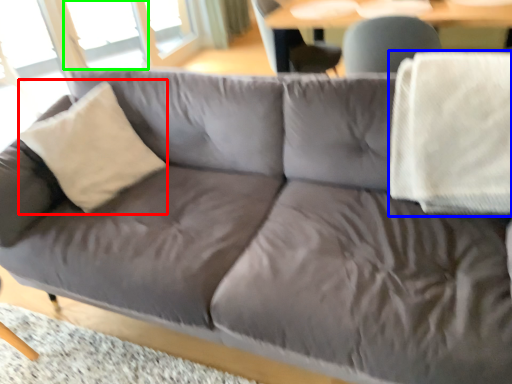
Question: Considering the real-world distances, which object is farthest from throw pillow (highlighted by a red box)? blanket (highlighted by a blue box) or window (highlighted by a green box)?

Choices:
 (A) blanket
 (B) window

Answer: (B)